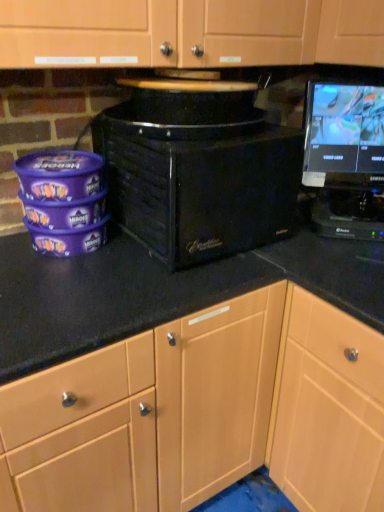
Question: Considering the positions of black glossy monitor at upper right and light wood cabinet at lower right in the image, is black glossy monitor at upper right wider or thinner than light wood cabinet at lower right?

Choices:
 (A) thin
 (B) wide

Answer: (A)

Question: Relative to light wood cabinet at lower right, is black glossy monitor at upper right in front or behind?

Choices:
 (A) front
 (B) behind

Answer: (B)

Question: Which object is the farthest from the black glossy monitor at upper right?

Choices:
 (A) light wood cabinet at lower right
 (B) black matte microwave at center

Answer: (A)

Question: Estimate the real-world distances between objects in this image. Which object is farther from the light wood cabinet at lower right?

Choices:
 (A) black matte microwave at center
 (B) black glossy monitor at upper right

Answer: (B)